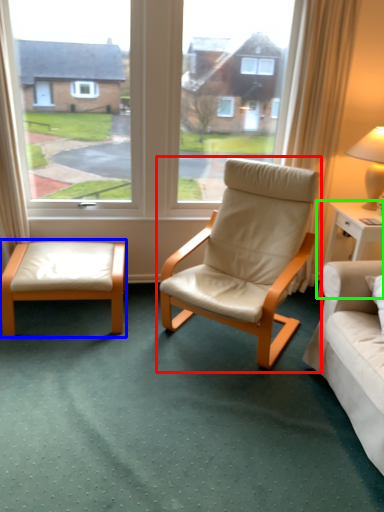
Question: Which object is positioned farthest from chair (highlighted by a red box)? Select from table (highlighted by a blue box) and nightstand (highlighted by a green box).

Choices:
 (A) table
 (B) nightstand

Answer: (A)